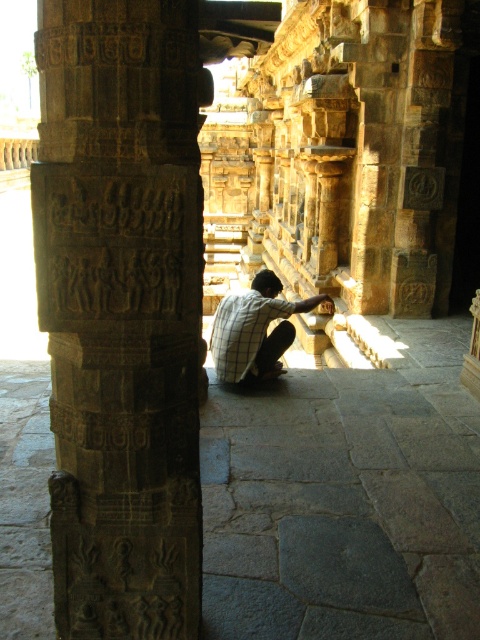
Question: Does dark brown stone pillar at left have a larger size compared to checkered fabric man at center?

Choices:
 (A) no
 (B) yes

Answer: (A)

Question: Considering the relative positions of dark brown stone pillar at left and checkered fabric man at center in the image provided, where is dark brown stone pillar at left located with respect to checkered fabric man at center?

Choices:
 (A) below
 (B) above

Answer: (A)

Question: Can you confirm if dark brown stone pillar at left is positioned to the left of checkered fabric man at center?

Choices:
 (A) yes
 (B) no

Answer: (A)